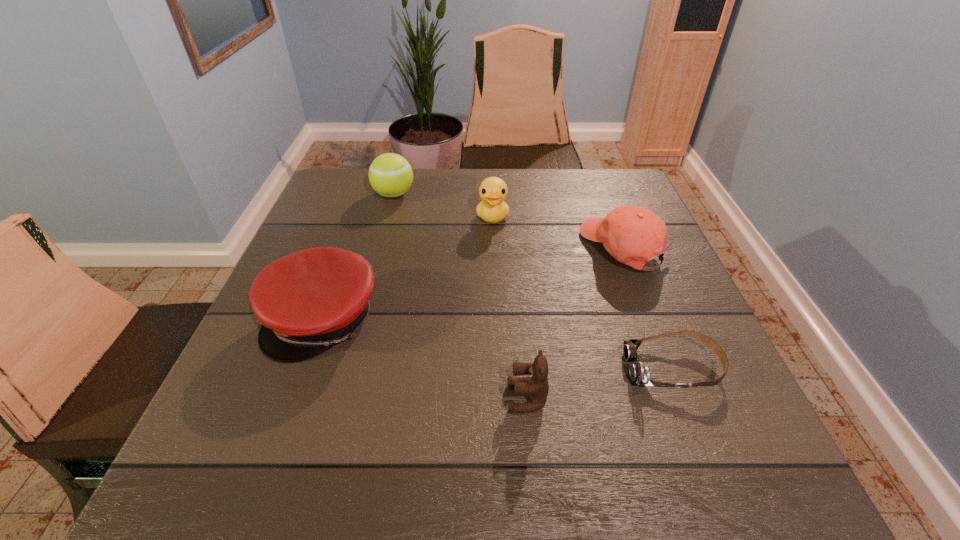
The width and height of the screenshot is (960, 540). In order to click on free region that satisfies the following two spatial constraints: 1. on the face of the baseball cap; 2. on the left side of the duck in this screenshot , I will do `click(493, 248)`.